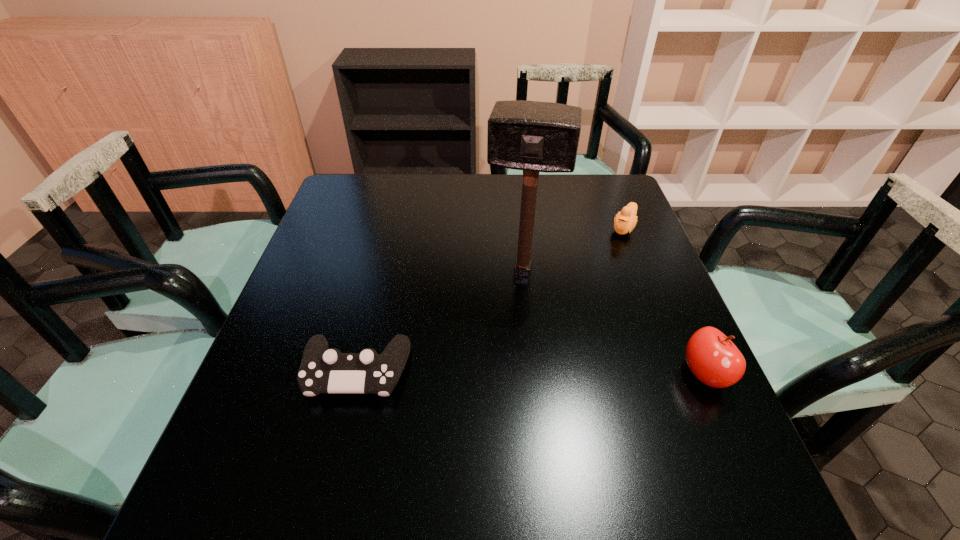
Identify the location of free space between the apple and the leftmost object. (531, 373).

At what (x,y) coordinates should I click in order to perform the action: click on vacant region between the farthest object and the control. Please return your answer as a coordinate pair (x, y). Looking at the image, I should click on (490, 300).

This screenshot has height=540, width=960. Find the location of `free space between the leftmost object and the duckling`. free space between the leftmost object and the duckling is located at coordinates (490, 300).

Where is `free space between the second tallest object and the duckling`? free space between the second tallest object and the duckling is located at coordinates (664, 301).

You are a GUI agent. You are given a task and a screenshot of the screen. Output one action in this format:
    pyautogui.click(x=<x>, y=<y>)
    Task: Click on the empty space that is in between the farthest object and the leftmost object
    The height and width of the screenshot is (540, 960).
    Given the screenshot: What is the action you would take?
    pyautogui.click(x=490, y=300)

Identify the location of empty space between the farthest object and the control. Image resolution: width=960 pixels, height=540 pixels. (490, 300).

You are a GUI agent. You are given a task and a screenshot of the screen. Output one action in this format:
    pyautogui.click(x=<x>, y=<y>)
    Task: Click on the vacant area between the duckling and the control
    
    Given the screenshot: What is the action you would take?
    pyautogui.click(x=490, y=300)

You are a GUI agent. You are given a task and a screenshot of the screen. Output one action in this format:
    pyautogui.click(x=<x>, y=<y>)
    Task: Click on the vacant area that lies between the duckling and the tallest object
    Image resolution: width=960 pixels, height=540 pixels.
    Given the screenshot: What is the action you would take?
    pyautogui.click(x=573, y=249)

Where is `vacant area that lies between the tallest object and the apple`? vacant area that lies between the tallest object and the apple is located at coordinates (613, 322).

Locate an element on the screen. The width and height of the screenshot is (960, 540). vacant area that lies between the second object from left to right and the control is located at coordinates (440, 321).